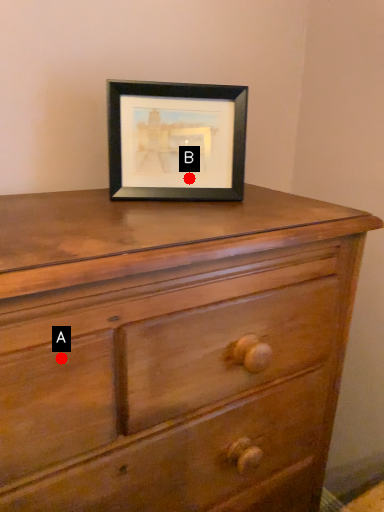
Question: Two points are circled on the image, labeled by A and B beside each circle. Which point is closer to the camera taking this photo?

Choices:
 (A) A is closer
 (B) B is closer

Answer: (A)